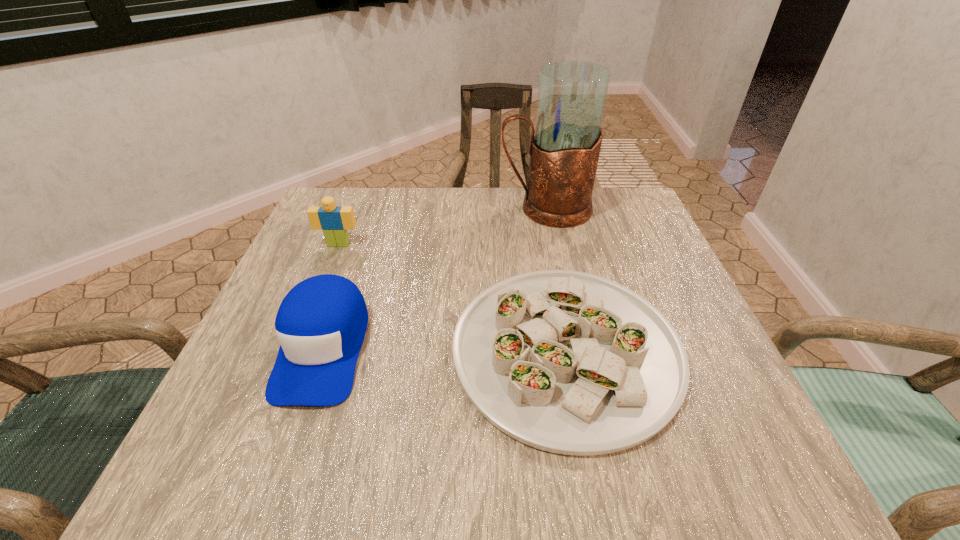
I want to click on vacant space located on the back of the shortest object, so click(540, 211).

Find the location of a particular element. pitcher that is positioned at the far edge is located at coordinates (564, 152).

At what (x,y) coordinates should I click in order to perform the action: click on Lego that is at the far edge. Please return your answer as a coordinate pair (x, y). The width and height of the screenshot is (960, 540). Looking at the image, I should click on (335, 220).

The image size is (960, 540). Find the location of `object located at the near edge`. object located at the near edge is located at coordinates [x=568, y=362].

What are the coordinates of `Lego that is positioned at the left edge` in the screenshot? It's located at (335, 220).

Locate an element on the screen. baseball cap present at the left edge is located at coordinates (321, 323).

Locate an element on the screen. This screenshot has width=960, height=540. pitcher at the right edge is located at coordinates (564, 152).

Where is `platter that is at the right edge`? The height and width of the screenshot is (540, 960). platter that is at the right edge is located at coordinates (568, 362).

The height and width of the screenshot is (540, 960). I want to click on object present at the far left corner, so click(335, 220).

What are the coordinates of `object located at the far right corner` in the screenshot? It's located at (564, 152).